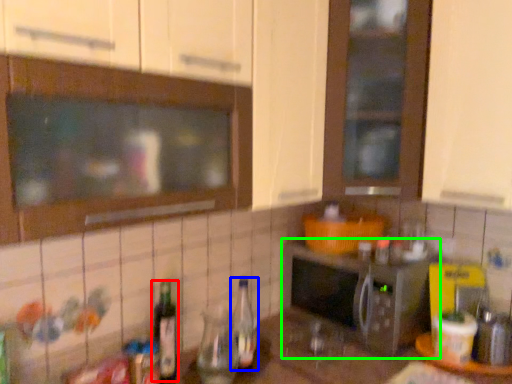
Question: Which is nearer to the bottle (highlighted by a red box)? bottle (highlighted by a blue box) or microwave oven (highlighted by a green box).

Choices:
 (A) bottle
 (B) microwave oven

Answer: (A)